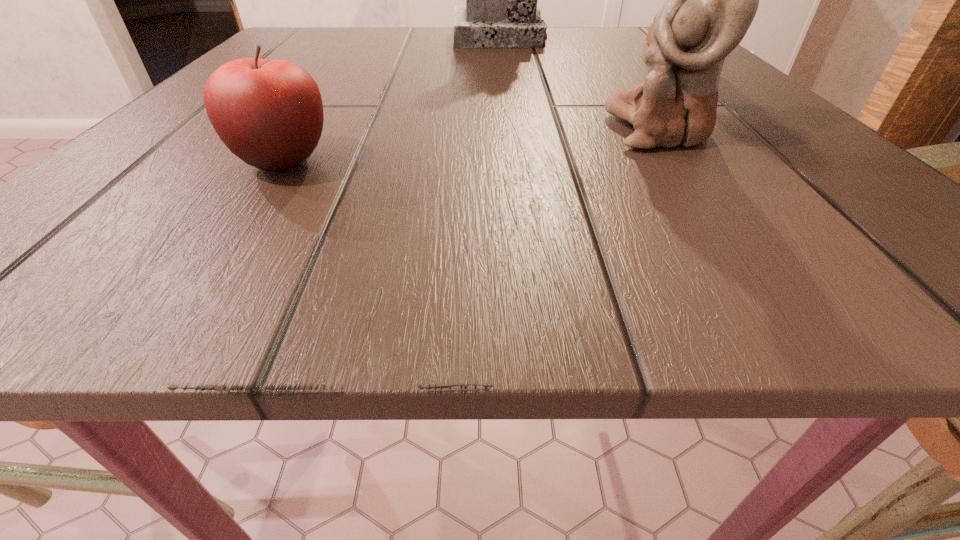
This screenshot has width=960, height=540. I want to click on figurine that stands as the closest to the second object from left to right, so click(649, 35).

The image size is (960, 540). Identify the location of figurine that is the third closest to the shortest object. (649, 35).

Locate an element on the screen. This screenshot has height=540, width=960. vacant point that satisfies the following two spatial constraints: 1. on the front-facing side of the second object from right to left; 2. on the front side of the apple is located at coordinates (684, 162).

Image resolution: width=960 pixels, height=540 pixels. Identify the location of free space that satisfies the following two spatial constraints: 1. on the front-facing side of the rightmost figurine; 2. on the front side of the apple. (789, 162).

The height and width of the screenshot is (540, 960). Identify the location of free space in the image that satisfies the following two spatial constraints: 1. on the front-facing side of the second figurine from right to left; 2. on the front side of the apple. (684, 162).